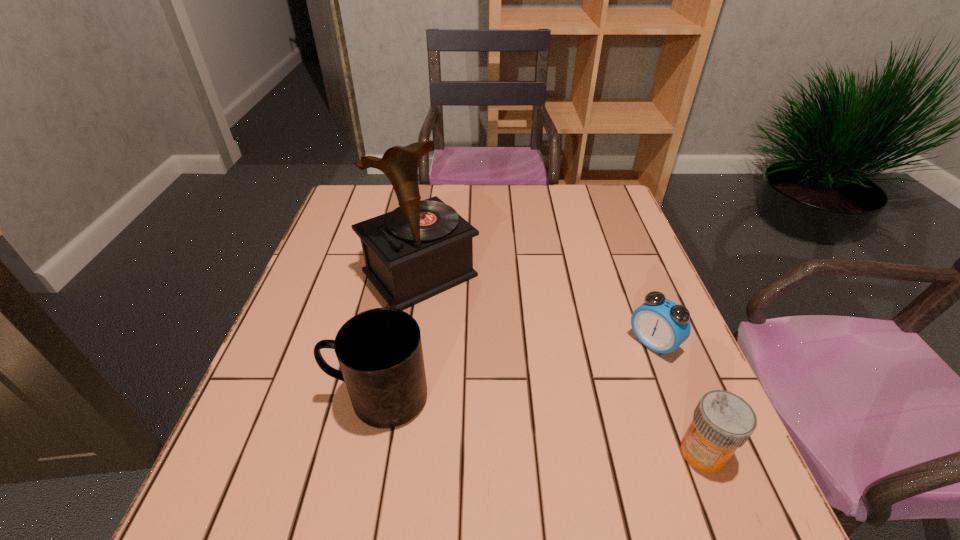
What are the coordinates of `object that ranks as the third closest to the third nearest object` in the screenshot? It's located at (379, 351).